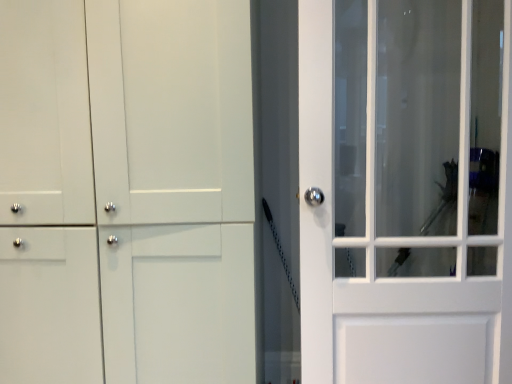
Question: Considering the relative sizes of white glass door at right and white matte cabinet at left in the image provided, is white glass door at right thinner than white matte cabinet at left?

Choices:
 (A) no
 (B) yes

Answer: (B)

Question: Considering the relative sizes of white glass door at right and white matte cabinet at left in the image provided, is white glass door at right bigger than white matte cabinet at left?

Choices:
 (A) no
 (B) yes

Answer: (A)

Question: Considering the relative positions of white glass door at right and white matte cabinet at left in the image provided, is white glass door at right to the right of white matte cabinet at left from the viewer's perspective?

Choices:
 (A) yes
 (B) no

Answer: (A)

Question: Is white glass door at right to the left of white matte cabinet at left from the viewer's perspective?

Choices:
 (A) no
 (B) yes

Answer: (A)

Question: From the image's perspective, is white glass door at right under white matte cabinet at left?

Choices:
 (A) yes
 (B) no

Answer: (B)

Question: Considering the relative sizes of white glass door at right and white matte cabinet at left in the image provided, is white glass door at right taller than white matte cabinet at left?

Choices:
 (A) no
 (B) yes

Answer: (A)

Question: Is white matte cabinet at left outside of white glass door at right?

Choices:
 (A) yes
 (B) no

Answer: (A)

Question: Is white matte cabinet at left smaller than white glass door at right?

Choices:
 (A) yes
 (B) no

Answer: (B)

Question: Can you confirm if white matte cabinet at left is wider than white glass door at right?

Choices:
 (A) yes
 (B) no

Answer: (A)

Question: Is there a large distance between white matte cabinet at left and white glass door at right?

Choices:
 (A) no
 (B) yes

Answer: (A)

Question: Is white matte cabinet at left positioned with its back to white glass door at right?

Choices:
 (A) no
 (B) yes

Answer: (A)

Question: From a real-world perspective, is white matte cabinet at left on white glass door at right?

Choices:
 (A) yes
 (B) no

Answer: (B)

Question: Relative to white matte cabinet at left, is white glass door at right in front or behind?

Choices:
 (A) behind
 (B) front

Answer: (A)